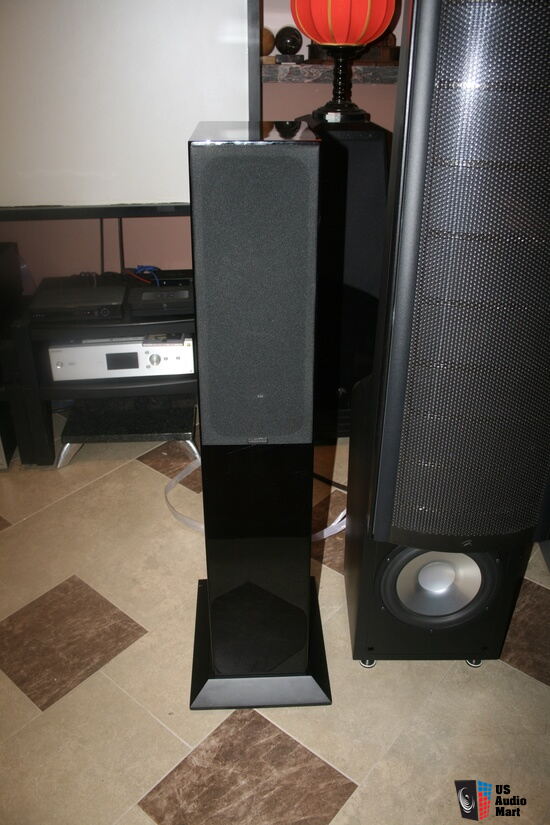
Find the location of a particular element. This screenshot has height=825, width=550. mauve wall is located at coordinates (145, 242).